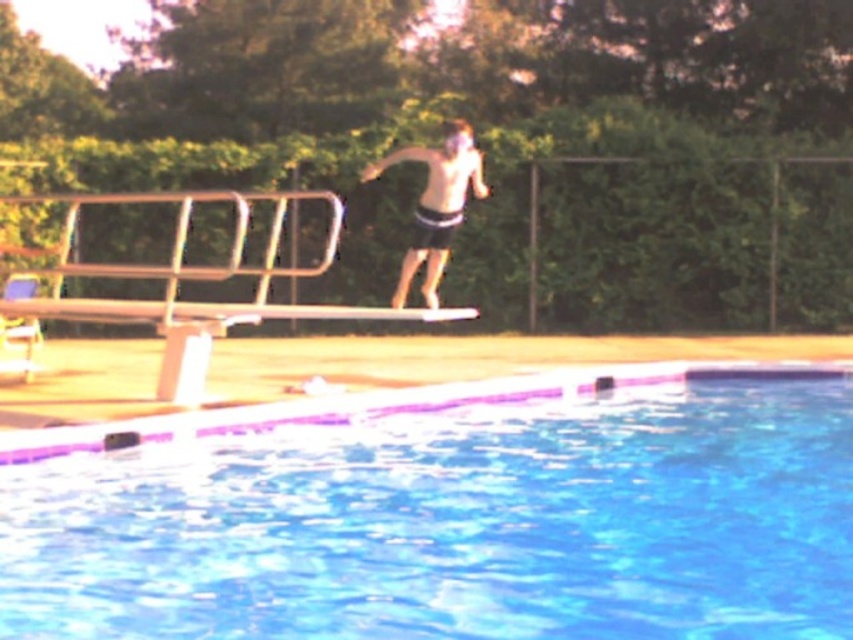
Does transparent plastic water at lower center have a larger size compared to dark gray shorts at center?

No, transparent plastic water at lower center is not bigger than dark gray shorts at center.

Can you confirm if transparent plastic water at lower center is positioned above dark gray shorts at center?

Incorrect, transparent plastic water at lower center is not positioned above dark gray shorts at center.

Where is `transparent plastic water at lower center`? This screenshot has width=853, height=640. transparent plastic water at lower center is located at coordinates (454, 515).

The image size is (853, 640). Find the location of `transparent plastic water at lower center`. transparent plastic water at lower center is located at coordinates (454, 515).